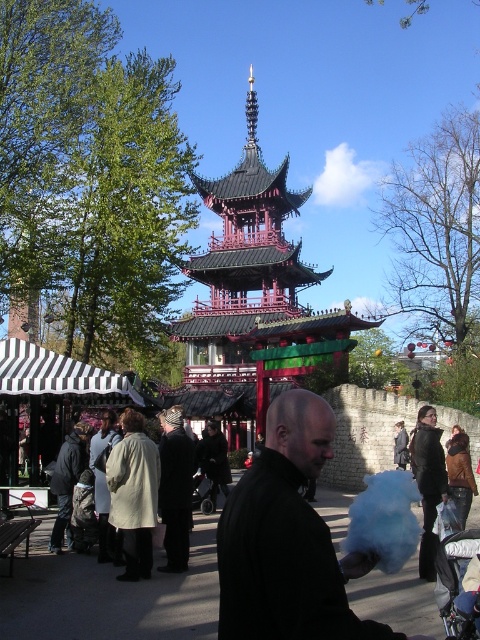
You are a photographer standing in front of the pagoda and want to take a photo that includes both the point at (265, 300) and the point at (289, 538). Based on their positions, which point is closer to the camera?

Point (289, 538) is closer to the camera than point (265, 300) because the description states that point (265, 300) is further away.

You are a visitor at the pagoda and see the black matte cotton candy at center and the dark gray jacket at center. Which object is bigger?

The black matte cotton candy at center is larger in size than the dark gray jacket at center.